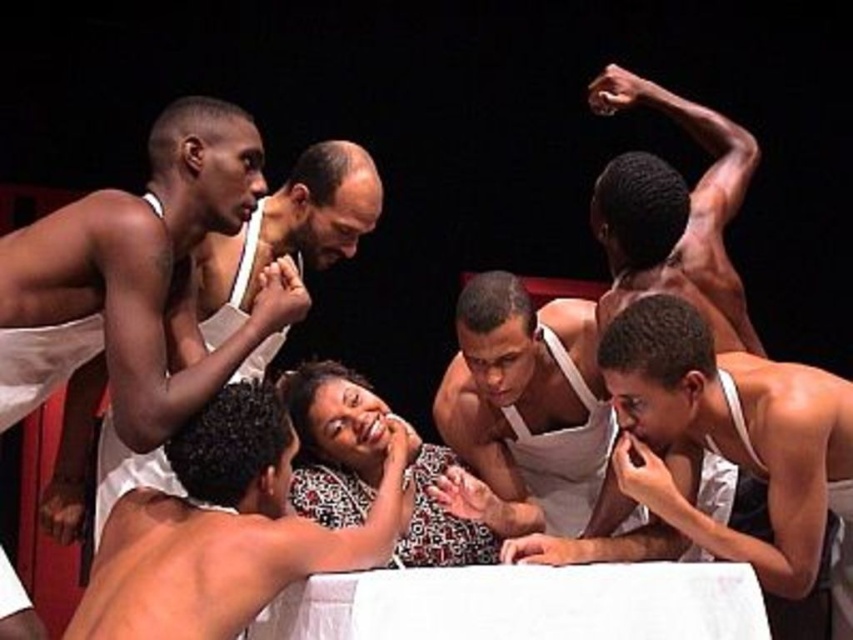
You are a photographer in the scene and want to take a closeup of the smooth white tank top at center without the smooth skin man at center blocking it. Is this possible?

The smooth skin man at center is in front of the smooth white tank top at center, so taking a closeup of the tank top without the man blocking it would require moving the man or adjusting the angle to ensure the tank top is visible without obstruction.

You are a stagehand preparing for a play. You notice the smooth skin man at center and the smooth white tank top at center in the scene. Which object is positioned lower in the image?

The smooth skin man at center is positioned lower than the smooth white tank top at center in the image.

You are a costume designer preparing for a play. You have a smooth skin man at center and a patterned fabric blouse at center in your design. Which one has a greater width according to the scene?

The smooth skin man at center has a greater width than the patterned fabric blouse at center, as stated in the description.